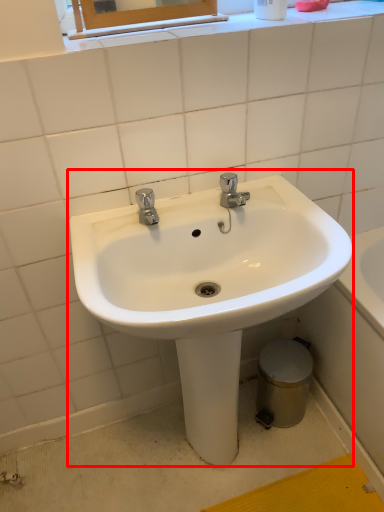
Question: In this image, where is sink (annotated by the red box) located relative to bidet?

Choices:
 (A) right
 (B) left

Answer: (B)